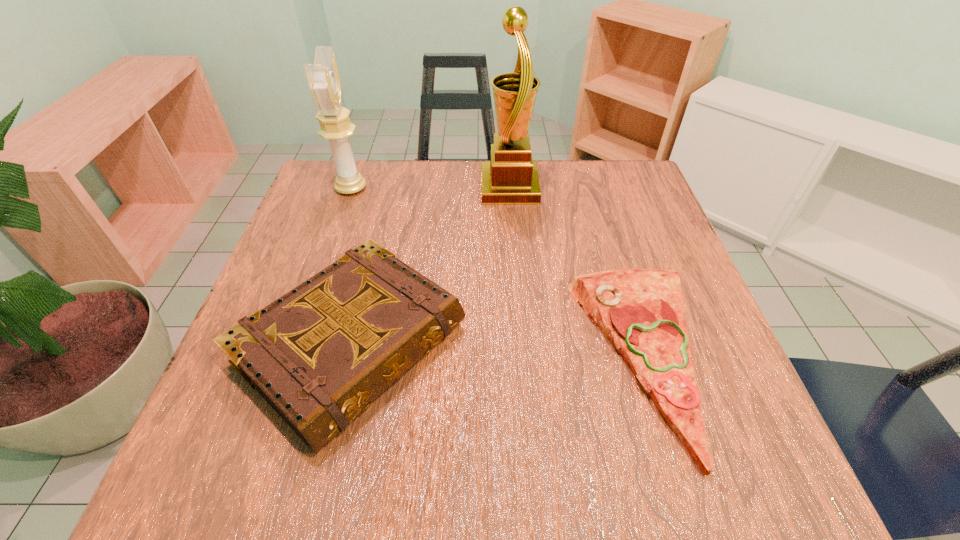
At what (x,y) coordinates should I click in order to perform the action: click on vacant space situated 0.250m on the front-facing side of the shorter award. Please return your answer as a coordinate pair (x, y). This screenshot has width=960, height=540. Looking at the image, I should click on (465, 188).

Where is `vacant space located 0.280m on the back of the hardback book`? vacant space located 0.280m on the back of the hardback book is located at coordinates (391, 188).

Locate an element on the screen. The height and width of the screenshot is (540, 960). vacant space situated 0.350m on the back of the rightmost object is located at coordinates (589, 179).

Find the location of a particular element. This screenshot has height=540, width=960. hardback book at the near edge is located at coordinates (319, 355).

The height and width of the screenshot is (540, 960). I want to click on pizza that is at the near edge, so click(x=641, y=311).

What are the coordinates of `award that is at the left edge` in the screenshot? It's located at (323, 77).

Find the location of `hardback book positioned at the left edge`. hardback book positioned at the left edge is located at coordinates (319, 355).

Identify the location of object that is at the right edge. (641, 311).

Locate an element on the screen. The height and width of the screenshot is (540, 960). object located in the far left corner section of the desktop is located at coordinates (323, 77).

The width and height of the screenshot is (960, 540). I want to click on object that is at the near left corner, so click(x=319, y=355).